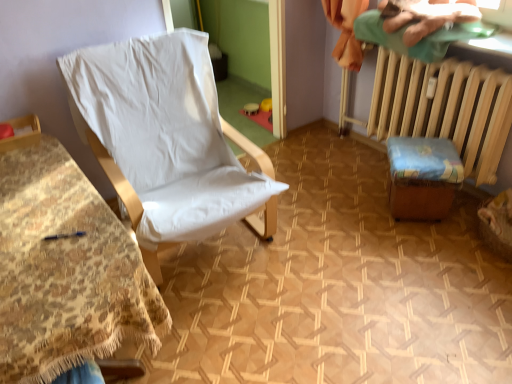
The width and height of the screenshot is (512, 384). I want to click on vacant area situated to the left side of wooden stool at lower right, the second furniture when ordered from left to right, so click(357, 213).